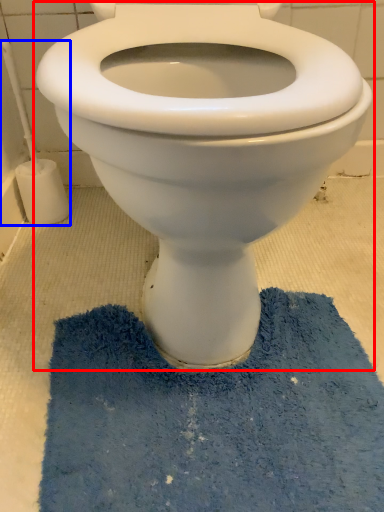
Question: Which of the following is the farthest to the observer, toilet (highlighted by a red box) or brush (highlighted by a blue box)?

Choices:
 (A) toilet
 (B) brush

Answer: (B)